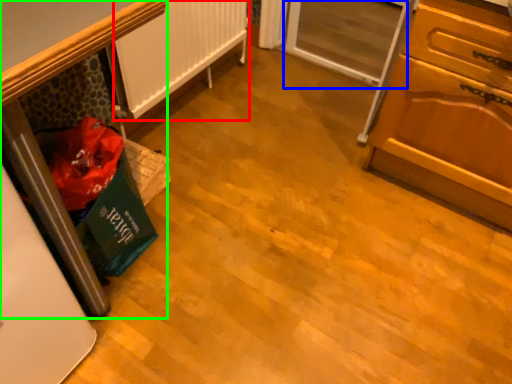
Question: Estimate the real-world distances between objects in this image. Which object is closer to radiator (highlighted by a red box), screen door (highlighted by a blue box) or furniture (highlighted by a green box)?

Choices:
 (A) screen door
 (B) furniture

Answer: (A)